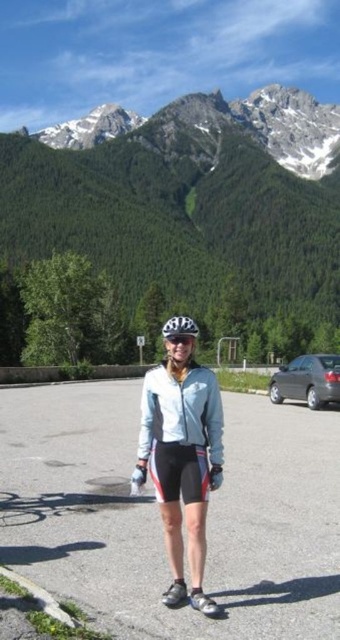
Can you confirm if satin silver sedan at right is positioned to the left of clear plastic goggles at center?

Incorrect, satin silver sedan at right is not on the left side of clear plastic goggles at center.

Who is higher up, satin silver sedan at right or clear plastic goggles at center?

clear plastic goggles at center is above.

Does point (278, 401) come farther from viewer compared to point (188, 337)?

Yes, point (278, 401) is farther from viewer.

This screenshot has width=340, height=640. Find the location of `satin silver sedan at right`. satin silver sedan at right is located at coordinates (308, 380).

Who is shorter, light blue fabric jacket at center or white matte helmet at center?

white matte helmet at center is shorter.

This screenshot has width=340, height=640. I want to click on light blue fabric jacket at center, so click(x=181, y=460).

Is satin silver sedan at right above matte black helmet at center?

Incorrect, satin silver sedan at right is not positioned above matte black helmet at center.

Who is positioned more to the right, satin silver sedan at right or matte black helmet at center?

From the viewer's perspective, satin silver sedan at right appears more on the right side.

This screenshot has height=640, width=340. Describe the element at coordinates (308, 380) in the screenshot. I see `satin silver sedan at right` at that location.

Where is `satin silver sedan at right`? The height and width of the screenshot is (640, 340). satin silver sedan at right is located at coordinates (308, 380).